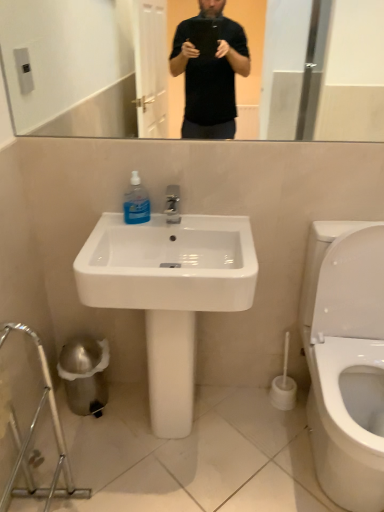
Question: Could you tell me if white plastic toilet brush at lower right is facing blue translucent liquid at sink?

Choices:
 (A) no
 (B) yes

Answer: (A)

Question: From a real-world perspective, is white plastic toilet brush at lower right positioned under blue translucent liquid at sink based on gravity?

Choices:
 (A) yes
 (B) no

Answer: (A)

Question: From the image's perspective, is white plastic toilet brush at lower right on blue translucent liquid at sink?

Choices:
 (A) yes
 (B) no

Answer: (B)

Question: Is white plastic toilet brush at lower right looking in the opposite direction of blue translucent liquid at sink?

Choices:
 (A) yes
 (B) no

Answer: (B)

Question: Would you say white plastic toilet brush at lower right is a long distance from blue translucent liquid at sink?

Choices:
 (A) no
 (B) yes

Answer: (A)

Question: From their relative heights in the image, would you say white plastic toilet brush at lower right is taller or shorter than white glossy sink at center?

Choices:
 (A) tall
 (B) short

Answer: (B)

Question: Would you say white plastic toilet brush at lower right is to the left or to the right of white glossy sink at center in the picture?

Choices:
 (A) left
 (B) right

Answer: (B)

Question: From a real-world perspective, is white plastic toilet brush at lower right physically located above or below white glossy sink at center?

Choices:
 (A) below
 (B) above

Answer: (A)

Question: Is point (281, 397) closer or farther from the camera than point (162, 266)?

Choices:
 (A) closer
 (B) farther

Answer: (B)

Question: Is blue translucent liquid at sink to the left or to the right of white glossy sink at center in the image?

Choices:
 (A) left
 (B) right

Answer: (A)

Question: Is blue translucent liquid at sink bigger or smaller than white glossy sink at center?

Choices:
 (A) big
 (B) small

Answer: (B)

Question: From a real-world perspective, is blue translucent liquid at sink positioned above or below white glossy sink at center?

Choices:
 (A) below
 (B) above

Answer: (B)

Question: In the image, is blue translucent liquid at sink positioned in front of or behind white glossy sink at center?

Choices:
 (A) behind
 (B) front

Answer: (A)

Question: Would you say white glossy sink at center is inside or outside white plastic toilet brush at lower right?

Choices:
 (A) outside
 (B) inside

Answer: (A)

Question: Is white glossy sink at center taller or shorter than white plastic toilet brush at lower right?

Choices:
 (A) short
 (B) tall

Answer: (B)